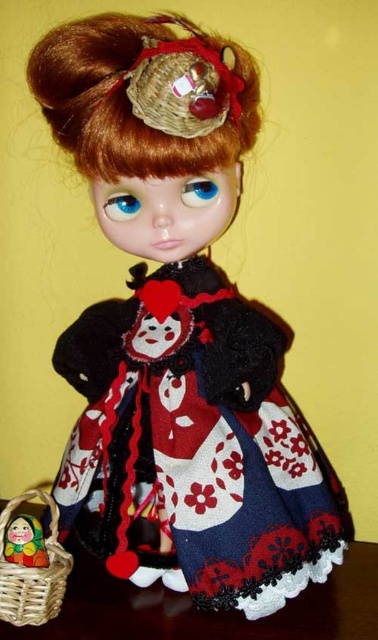
Does wooden table at lower left appear over woven brown basket at lower left?

Incorrect, wooden table at lower left is not positioned above woven brown basket at lower left.

Identify the location of wooden table at lower left. The width and height of the screenshot is (378, 640). (210, 611).

Is wooden table at lower left thinner than matte yellow basket at lower left?

In fact, wooden table at lower left might be wider than matte yellow basket at lower left.

Does wooden table at lower left have a lesser height compared to matte yellow basket at lower left?

Correct, wooden table at lower left is not as tall as matte yellow basket at lower left.

Which is in front, point (190, 632) or point (15, 522)?

Positioned in front is point (190, 632).

Where is `wooden table at lower left`? This screenshot has height=640, width=378. wooden table at lower left is located at coordinates [210, 611].

Can you confirm if woven brown basket at lower left is bigger than matte yellow basket at lower left?

Yes, woven brown basket at lower left is bigger than matte yellow basket at lower left.

Looking at this image, which is above, woven brown basket at lower left or matte yellow basket at lower left?

matte yellow basket at lower left is above.

Who is more distant from viewer, (x=9, y=605) or (x=32, y=563)?

The point (x=32, y=563) is more distant.

Locate an element on the screen. woven brown basket at lower left is located at coordinates (32, 572).